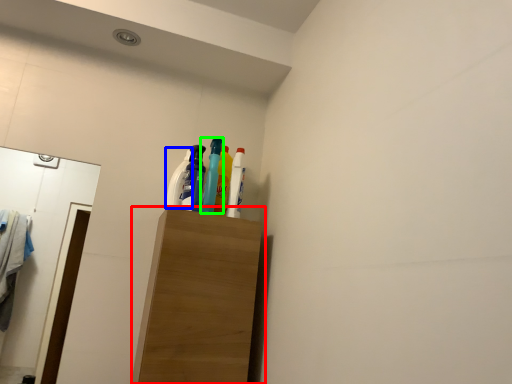
Question: Which object is the farthest from furniture (highlighted by a red box)? Choose among these: cleaning product (highlighted by a blue box) or bottle (highlighted by a green box).

Choices:
 (A) cleaning product
 (B) bottle

Answer: (A)